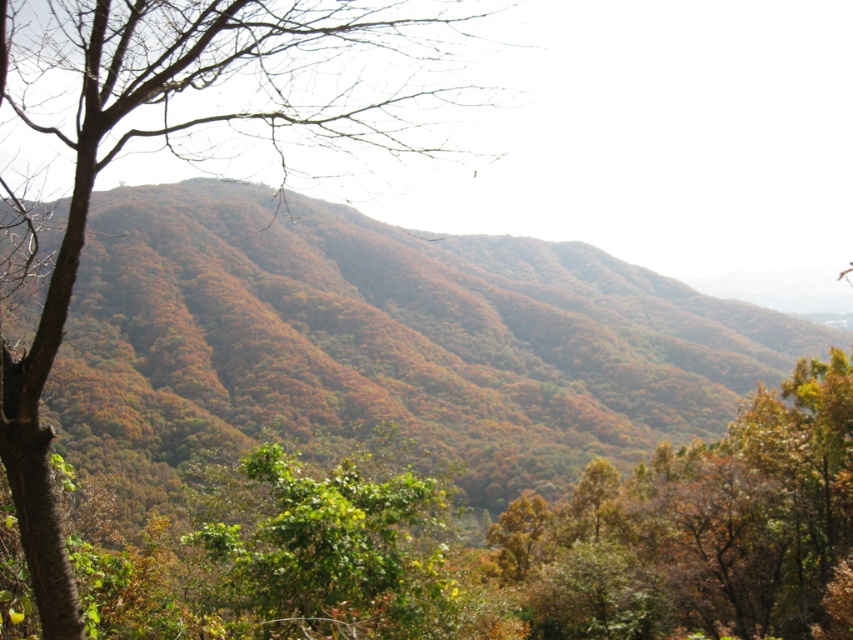
You are an environmental researcher assessing tree health in this mountainous area. You observe the bare branches at left and the green leafy tree at center. Which tree has a wider trunk?

The bare branches at left has a wider trunk than the green leafy tree at center, as its width surpasses the latter.

You are a hiker standing at the base of the bare branches at left and the green leafy tree at center. Which tree would you need to look up higher to see the top of?

The bare branches at left is much taller than the green leafy tree at center, so you would need to look up higher to see the top of the bare branches at left.